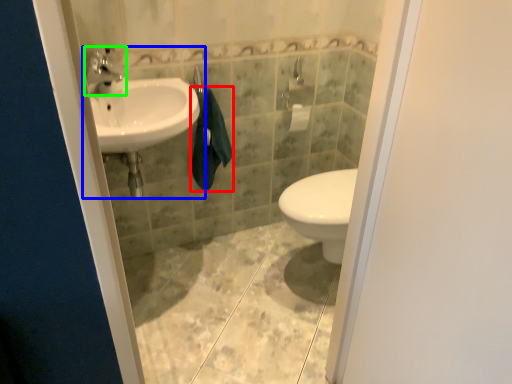
Question: Considering the real-world distances, which object is closest to bath towel (highlighted by a red box)? sink (highlighted by a blue box) or tap (highlighted by a green box).

Choices:
 (A) sink
 (B) tap

Answer: (A)